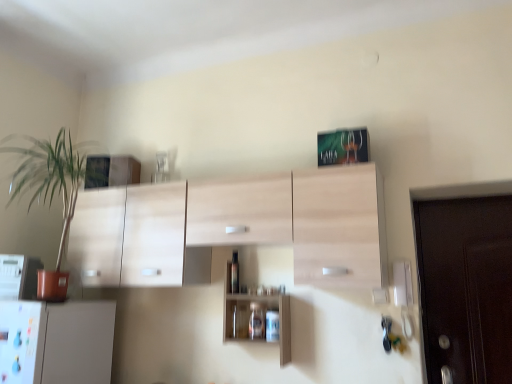
Question: Is green leafy plant at left oriented towards white plastic microwave at left?

Choices:
 (A) yes
 (B) no

Answer: (B)

Question: Is green leafy plant at left positioned with its back to white plastic microwave at left?

Choices:
 (A) no
 (B) yes

Answer: (A)

Question: Is green leafy plant at left shorter than white plastic microwave at left?

Choices:
 (A) yes
 (B) no

Answer: (B)

Question: Is white plastic microwave at left a part of green leafy plant at left?

Choices:
 (A) yes
 (B) no

Answer: (B)

Question: Is green leafy plant at left further to camera compared to white plastic microwave at left?

Choices:
 (A) yes
 (B) no

Answer: (B)

Question: Can you confirm if green leafy plant at left is thinner than white plastic microwave at left?

Choices:
 (A) yes
 (B) no

Answer: (B)

Question: Considering the relative sizes of white plastic microwave at left and transparent glass bottle at center in the image provided, is white plastic microwave at left shorter than transparent glass bottle at center?

Choices:
 (A) yes
 (B) no

Answer: (A)

Question: Is white plastic microwave at left far from transparent glass bottle at center?

Choices:
 (A) no
 (B) yes

Answer: (B)

Question: Is white plastic microwave at left positioned behind transparent glass bottle at center?

Choices:
 (A) no
 (B) yes

Answer: (A)

Question: Does white plastic microwave at left have a lesser width compared to transparent glass bottle at center?

Choices:
 (A) no
 (B) yes

Answer: (A)

Question: Considering the relative sizes of white plastic microwave at left and transparent glass bottle at center in the image provided, is white plastic microwave at left wider than transparent glass bottle at center?

Choices:
 (A) no
 (B) yes

Answer: (B)

Question: Is the position of white plastic microwave at left less distant than that of transparent glass bottle at center?

Choices:
 (A) yes
 (B) no

Answer: (A)

Question: Considering the relative sizes of wooden cabinet at center and white plastic microwave at left in the image provided, is wooden cabinet at center wider than white plastic microwave at left?

Choices:
 (A) no
 (B) yes

Answer: (A)